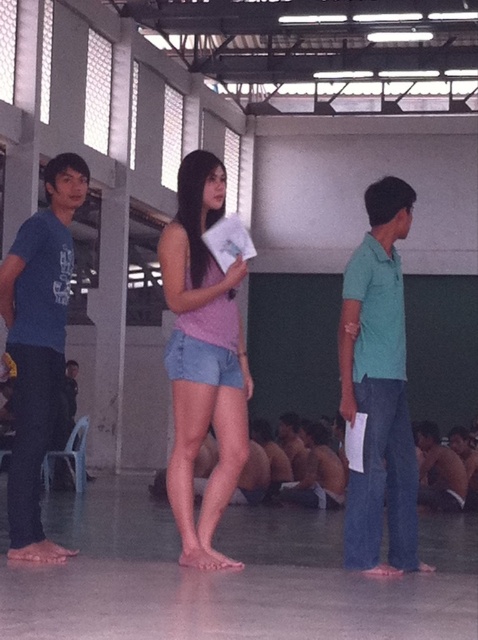
Which is behind, point (43, 362) or point (454, 490)?

The point (454, 490) is behind.

Is matte blue shirt at left taller than shiny metallic shirt at lower right?

Yes, matte blue shirt at left is taller than shiny metallic shirt at lower right.

Is point (40, 244) positioned behind point (442, 468)?

No.

Where is `matte blue shirt at left`? The image size is (478, 640). matte blue shirt at left is located at coordinates (39, 346).

Consider the image. Between teal matte shirt at center and matte blue shirt at left, which one has less height?

With less height is teal matte shirt at center.

Is teal matte shirt at center behind matte blue shirt at left?

Yes, it is behind matte blue shirt at left.

The height and width of the screenshot is (640, 478). I want to click on teal matte shirt at center, so click(x=379, y=388).

Does denim shorts at center have a lesser width compared to matte blue shirt at left?

Incorrect, denim shorts at center's width is not less than matte blue shirt at left's.

Who is more forward, [237,429] or [46,560]?

Point [237,429]

Which is behind, point (207, 394) or point (36, 429)?

The point (36, 429) is behind.

Locate an element on the screen. denim shorts at center is located at coordinates (203, 358).